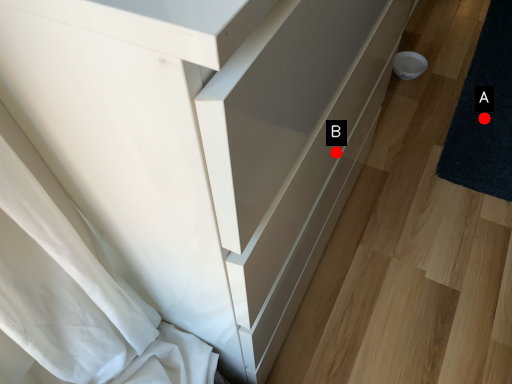
Question: Two points are circled on the image, labeled by A and B beside each circle. Which point is farther to the camera?

Choices:
 (A) A is further
 (B) B is further

Answer: (A)